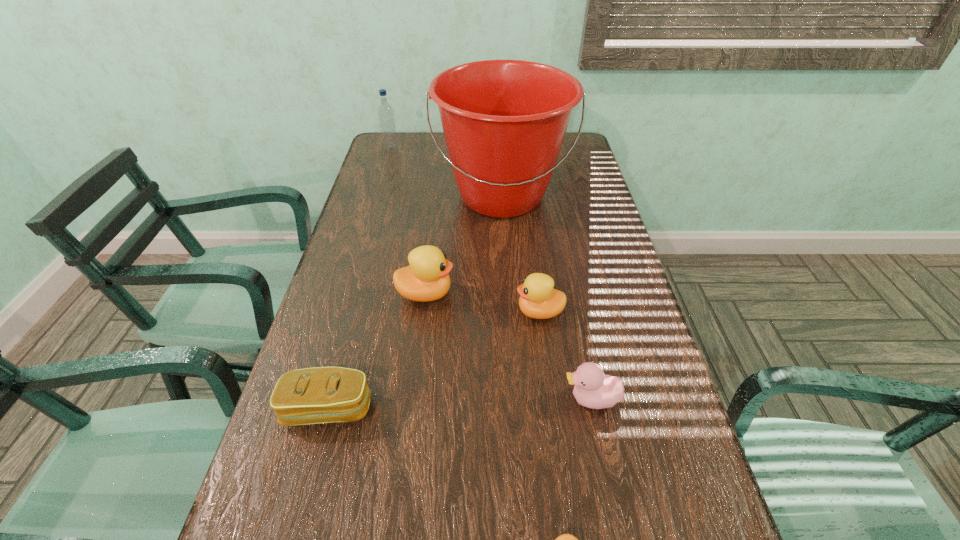
You are a GUI agent. You are given a task and a screenshot of the screen. Output one action in this format:
    pyautogui.click(x=<x>, y=<y>)
    Task: Click on the bucket
    This screenshot has width=960, height=540.
    Given the screenshot: What is the action you would take?
    pyautogui.click(x=504, y=121)

Identify the location of the tallest object. (504, 121).

The image size is (960, 540). I want to click on water bottle, so click(x=386, y=118).

At what (x,y) coordinates should I click in order to perform the action: click on the second tallest object. Please return your answer as a coordinate pair (x, y). Image resolution: width=960 pixels, height=540 pixels. Looking at the image, I should click on click(x=386, y=118).

At what (x,y) coordinates should I click in order to perform the action: click on the leftmost duckling. Please return your answer as a coordinate pair (x, y). Looking at the image, I should click on (427, 278).

Identify the location of the tallest duckling. (427, 278).

The height and width of the screenshot is (540, 960). Find the location of `the second biggest yellow duckling`. the second biggest yellow duckling is located at coordinates (538, 299).

Find the location of a particular element. Image resolution: width=960 pixels, height=540 pixels. pink duckling is located at coordinates (593, 389).

Where is `clutch bag`? clutch bag is located at coordinates (316, 395).

Locate an element on the screen. This screenshot has width=960, height=540. vacant space located with the handle attached to the rim of the red bucket is located at coordinates (508, 303).